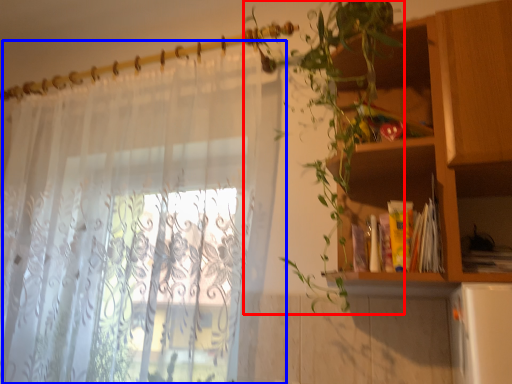
Question: Which object appears closest to the camera in this image, vegetation (highlighted by a red box) or curtain (highlighted by a blue box)?

Choices:
 (A) vegetation
 (B) curtain

Answer: (A)